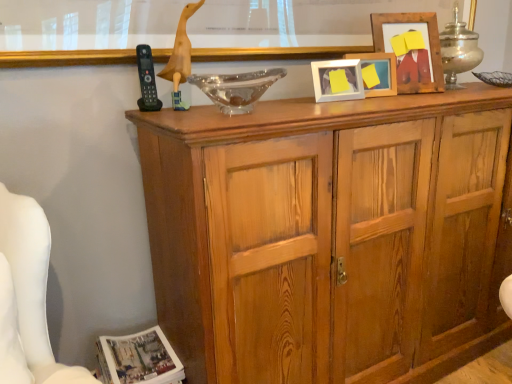
Question: Does white glossy magazine at lower left come behind white matte picture frame at upper center, the 3th picture frame in the right-to-left sequence?

Choices:
 (A) no
 (B) yes

Answer: (A)

Question: Can you confirm if white glossy magazine at lower left is smaller than white matte picture frame at upper center, the 3th picture frame in the right-to-left sequence?

Choices:
 (A) yes
 (B) no

Answer: (B)

Question: From a real-world perspective, is white glossy magazine at lower left located beneath white matte picture frame at upper center, arranged as the 1th picture frame when viewed from the left?

Choices:
 (A) yes
 (B) no

Answer: (A)

Question: Does white glossy magazine at lower left lie in front of white matte picture frame at upper center, arranged as the 1th picture frame when viewed from the left?

Choices:
 (A) yes
 (B) no

Answer: (A)

Question: Is white glossy magazine at lower left next to white matte picture frame at upper center, the 3th picture frame in the right-to-left sequence?

Choices:
 (A) no
 (B) yes

Answer: (A)

Question: Can you confirm if white glossy magazine at lower left is wider than white matte picture frame at upper center, arranged as the 1th picture frame when viewed from the left?

Choices:
 (A) yes
 (B) no

Answer: (A)

Question: Does yellow matte picture frame at upper center, which ranks as the 2th picture frame in left-to-right order, appear on the left side of white matte picture frame at upper center, arranged as the 1th picture frame when viewed from the left?

Choices:
 (A) yes
 (B) no

Answer: (B)

Question: Is white matte picture frame at upper center, the 3th picture frame in the right-to-left sequence, completely or partially inside yellow matte picture frame at upper center, which ranks as the 2th picture frame in left-to-right order?

Choices:
 (A) yes
 (B) no

Answer: (B)

Question: Does yellow matte picture frame at upper center, which ranks as the 2th picture frame in left-to-right order, have a greater width compared to white matte picture frame at upper center, the 3th picture frame in the right-to-left sequence?

Choices:
 (A) yes
 (B) no

Answer: (A)

Question: Considering the relative sizes of yellow matte picture frame at upper center, which ranks as the 2th picture frame in left-to-right order, and white matte picture frame at upper center, the 3th picture frame in the right-to-left sequence, in the image provided, is yellow matte picture frame at upper center, which ranks as the 2th picture frame in left-to-right order, taller than white matte picture frame at upper center, the 3th picture frame in the right-to-left sequence,?

Choices:
 (A) no
 (B) yes

Answer: (B)

Question: Is yellow matte picture frame at upper center, the second picture frame positioned from the right, to the right of white matte picture frame at upper center, the 3th picture frame in the right-to-left sequence, from the viewer's perspective?

Choices:
 (A) yes
 (B) no

Answer: (A)

Question: Is yellow matte picture frame at upper center, which ranks as the 2th picture frame in left-to-right order, facing towards white matte picture frame at upper center, the 3th picture frame in the right-to-left sequence?

Choices:
 (A) yes
 (B) no

Answer: (B)

Question: Is wooden cabinet at center wider than wooden duck at upper center?

Choices:
 (A) no
 (B) yes

Answer: (B)